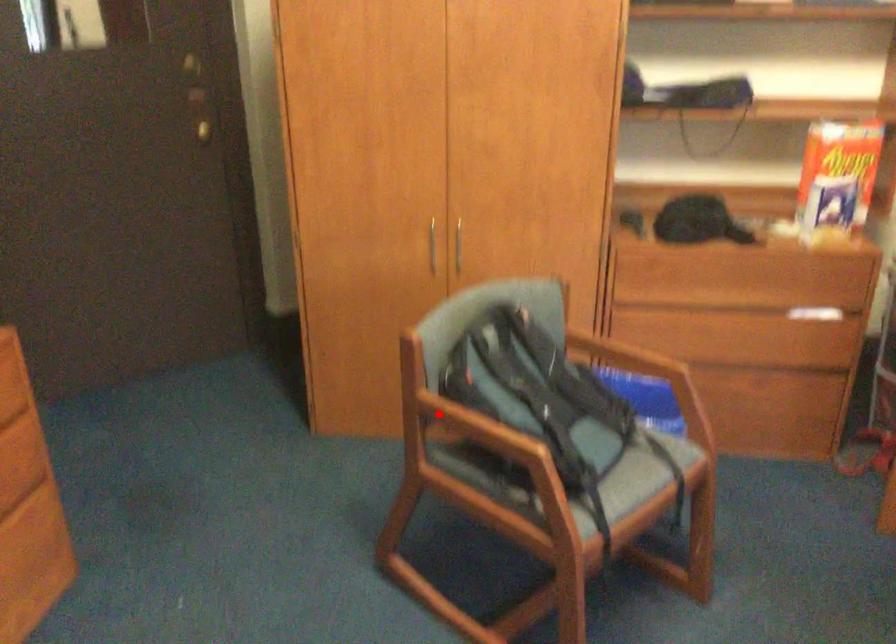
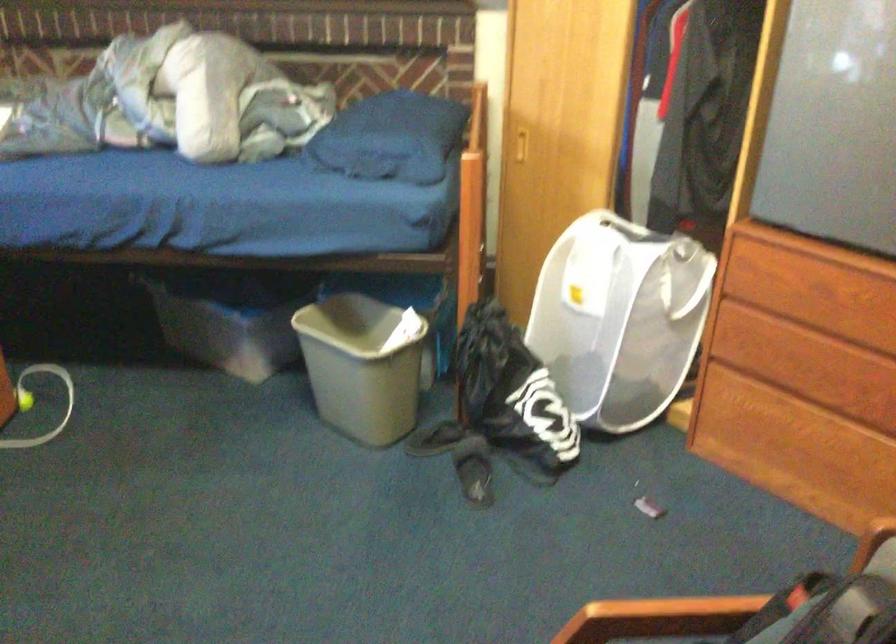
Locate, in the second image, the point that corresponds to the highlighted location in the first image.

(757, 614)